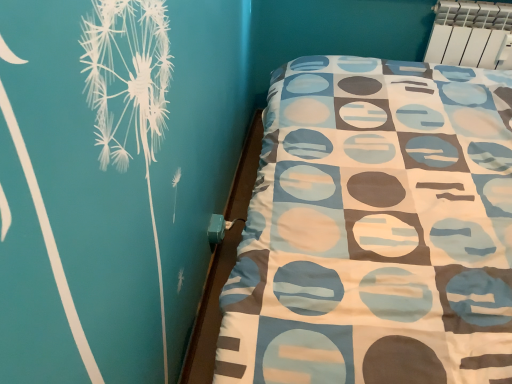
Question: Considering the relative sizes of teal plastic bed frame at lower right and white plastic radiator at upper right in the image provided, is teal plastic bed frame at lower right smaller than white plastic radiator at upper right?

Choices:
 (A) no
 (B) yes

Answer: (B)

Question: Is teal plastic bed frame at lower right wider than white plastic radiator at upper right?

Choices:
 (A) yes
 (B) no

Answer: (B)

Question: Does teal plastic bed frame at lower right have a larger size compared to white plastic radiator at upper right?

Choices:
 (A) yes
 (B) no

Answer: (B)

Question: Is white plastic radiator at upper right surrounded by teal plastic bed frame at lower right?

Choices:
 (A) no
 (B) yes

Answer: (A)

Question: Is the depth of teal plastic bed frame at lower right less than that of white plastic radiator at upper right?

Choices:
 (A) yes
 (B) no

Answer: (A)

Question: From a real-world perspective, is teal plastic bed frame at lower right under white plastic radiator at upper right?

Choices:
 (A) no
 (B) yes

Answer: (B)

Question: Is white plastic radiator at upper right wider than teal plastic bed frame at lower right?

Choices:
 (A) no
 (B) yes

Answer: (B)

Question: Considering the relative sizes of white plastic radiator at upper right and teal plastic bed frame at lower right in the image provided, is white plastic radiator at upper right bigger than teal plastic bed frame at lower right?

Choices:
 (A) no
 (B) yes

Answer: (B)

Question: From the image's perspective, is white plastic radiator at upper right below teal plastic bed frame at lower right?

Choices:
 (A) yes
 (B) no

Answer: (B)

Question: Considering the relative positions of white plastic radiator at upper right and teal plastic bed frame at lower right in the image provided, is white plastic radiator at upper right to the right of teal plastic bed frame at lower right from the viewer's perspective?

Choices:
 (A) no
 (B) yes

Answer: (B)

Question: Considering the relative sizes of white plastic radiator at upper right and teal plastic bed frame at lower right in the image provided, is white plastic radiator at upper right taller than teal plastic bed frame at lower right?

Choices:
 (A) no
 (B) yes

Answer: (B)

Question: From a real-world perspective, is white plastic radiator at upper right physically below teal plastic bed frame at lower right?

Choices:
 (A) yes
 (B) no

Answer: (B)

Question: Which is correct: teal plastic bed frame at lower right is inside white plastic radiator at upper right, or outside of it?

Choices:
 (A) outside
 (B) inside

Answer: (A)